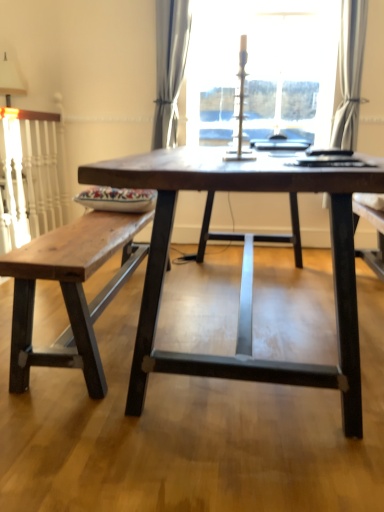
Identify the location of free location to the right of rustic wood bench at left. (237, 332).